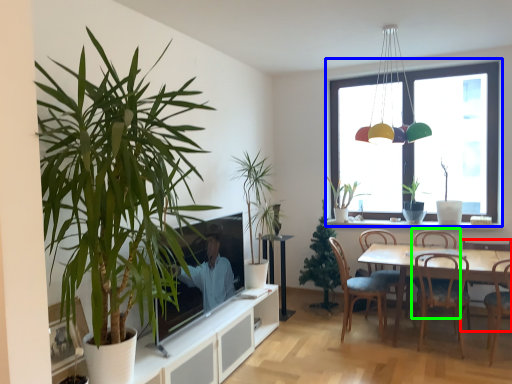
Question: Which object is the farthest from chair (highlighted by a red box)? Choose among these: window (highlighted by a blue box) or armchair (highlighted by a green box).

Choices:
 (A) window
 (B) armchair

Answer: (A)